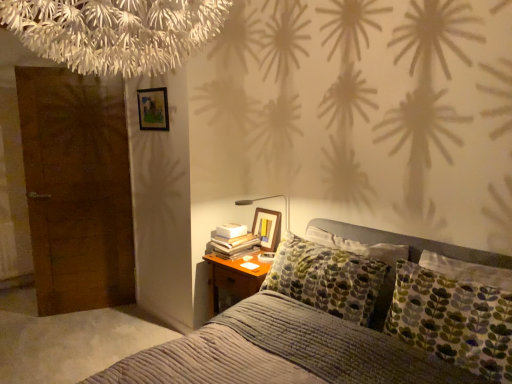
The width and height of the screenshot is (512, 384). I want to click on vacant space situated above wooden picture frame at upper right, arranged as the second picture frame when viewed from the left (from a real-world perspective), so click(x=266, y=206).